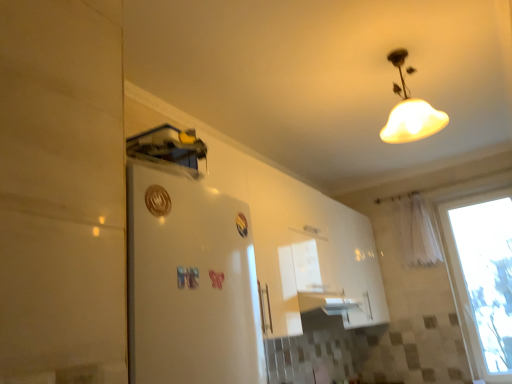
Image resolution: width=512 pixels, height=384 pixels. What do you see at coordinates (410, 112) in the screenshot? I see `white matte lampshade at upper center` at bounding box center [410, 112].

What do you see at coordinates (416, 231) in the screenshot? I see `white sheer curtain at right` at bounding box center [416, 231].

In order to click on white sheer curtain at right in this screenshot , I will do `click(416, 231)`.

Where is `transparent glass window at right`? The image size is (512, 384). transparent glass window at right is located at coordinates (481, 278).

How far apart are white matte lampshade at upper center and white sheer curtain at right?

The distance of white matte lampshade at upper center from white sheer curtain at right is 1.68 meters.

From a real-world perspective, is white matte lampshade at upper center physically located above or below white sheer curtain at right?

In terms of real-world spatial position, white matte lampshade at upper center is above white sheer curtain at right.

Does white matte lampshade at upper center touch white sheer curtain at right?

No, white matte lampshade at upper center is not making contact with white sheer curtain at right.

Is white matte lampshade at upper center at the left side of white sheer curtain at right?

Yes, white matte lampshade at upper center is to the left of white sheer curtain at right.

The image size is (512, 384). Identify the location of lamp in front of the white sheer curtain at right. (410, 112).

Consider the image. Is white sheer curtain at right in front of or behind white matte lampshade at upper center in the image?

white sheer curtain at right is positioned farther from the viewer than white matte lampshade at upper center.

Consider the image. From the image's perspective, is white sheer curtain at right below white matte lampshade at upper center?

Indeed, from the image's perspective, white sheer curtain at right is shown beneath white matte lampshade at upper center.

Is white sheer curtain at right situated inside white matte lampshade at upper center or outside?

white sheer curtain at right exists outside the volume of white matte lampshade at upper center.

From a real-world perspective, is white matte lampshade at upper center positioned above or below transparent glass window at right?

In terms of real-world spatial position, white matte lampshade at upper center is above transparent glass window at right.

Considering the positions of objects white matte lampshade at upper center and transparent glass window at right in the image provided, who is in front, white matte lampshade at upper center or transparent glass window at right?

white matte lampshade at upper center is in front.

From the image's perspective, which one is positioned lower, white matte lampshade at upper center or transparent glass window at right?

transparent glass window at right.

How far apart are white matte lampshade at upper center and transparent glass window at right?

white matte lampshade at upper center and transparent glass window at right are 1.90 meters apart from each other.

Looking at this image, are white sheer curtain at right and transparent glass window at right located far from each other?

white sheer curtain at right is actually quite close to transparent glass window at right.

Does white sheer curtain at right have a greater height compared to transparent glass window at right?

Incorrect, the height of white sheer curtain at right is not larger of that of transparent glass window at right.

From a real-world perspective, is white sheer curtain at right physically located above or below transparent glass window at right?

white sheer curtain at right is situated higher than transparent glass window at right in the real world.

From the picture: From the image's perspective, is white sheer curtain at right positioned above or below transparent glass window at right?

white sheer curtain at right is situated higher than transparent glass window at right in the image.

Could white matte lampshade at upper center be considered to be inside transparent glass window at right?

No, white matte lampshade at upper center is not surrounded by transparent glass window at right.

How far apart are transparent glass window at right and white matte lampshade at upper center?

The distance of transparent glass window at right from white matte lampshade at upper center is 1.90 meters.

Between transparent glass window at right and white matte lampshade at upper center, which one has smaller size?

Smaller between the two is white matte lampshade at upper center.

At what (x,y) coordinates should I click in order to perform the action: click on window lying on the right of white matte lampshade at upper center. Please return your answer as a coordinate pair (x, y). Looking at the image, I should click on (481, 278).

Can you confirm if transparent glass window at right is bigger than white sheer curtain at right?

Indeed, transparent glass window at right has a larger size compared to white sheer curtain at right.

Considering the positions of points (446, 211) and (406, 259), is point (446, 211) farther from camera compared to point (406, 259)?

Yes, it is behind point (406, 259).

From the image's perspective, is transparent glass window at right above or below white sheer curtain at right?

From the image's perspective, transparent glass window at right appears below white sheer curtain at right.

In the image, is transparent glass window at right positioned in front of or behind white sheer curtain at right?

transparent glass window at right is in front of white sheer curtain at right.

Image resolution: width=512 pixels, height=384 pixels. Identify the location of lamp in front of the white sheer curtain at right. (x=410, y=112).

I want to click on curtain that is on the right side of white matte lampshade at upper center, so click(416, 231).

Considering their positions, is transparent glass window at right positioned closer to white matte lampshade at upper center than white sheer curtain at right?

white sheer curtain at right is closer to white matte lampshade at upper center.

Considering their positions, is white matte lampshade at upper center positioned closer to transparent glass window at right than white sheer curtain at right?

The object closer to transparent glass window at right is white sheer curtain at right.

Based on their spatial positions, is white sheer curtain at right or transparent glass window at right further from white matte lampshade at upper center?

transparent glass window at right is further to white matte lampshade at upper center.

When comparing their distances from white sheer curtain at right, does transparent glass window at right or white matte lampshade at upper center seem further?

white matte lampshade at upper center is further to white sheer curtain at right.

When comparing their distances from white sheer curtain at right, does white matte lampshade at upper center or transparent glass window at right seem further?

The object further to white sheer curtain at right is white matte lampshade at upper center.

Which object lies further to the anchor point transparent glass window at right, white sheer curtain at right or white matte lampshade at upper center?

white matte lampshade at upper center is further to transparent glass window at right.

Identify the location of window located between white matte lampshade at upper center and white sheer curtain at right in the depth direction. This screenshot has height=384, width=512. (481, 278).